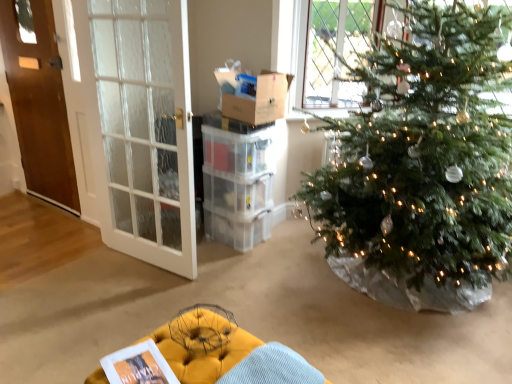
Question: From a real-world perspective, is yellow tufted ottoman at lower center over cardboard box at upper center?

Choices:
 (A) no
 (B) yes

Answer: (A)

Question: Would you consider yellow tufted ottoman at lower center to be distant from cardboard box at upper center?

Choices:
 (A) yes
 (B) no

Answer: (A)

Question: From a real-world perspective, is yellow tufted ottoman at lower center beneath cardboard box at upper center?

Choices:
 (A) no
 (B) yes

Answer: (B)

Question: Is yellow tufted ottoman at lower center facing away from cardboard box at upper center?

Choices:
 (A) yes
 (B) no

Answer: (B)

Question: Is the depth of yellow tufted ottoman at lower center less than that of cardboard box at upper center?

Choices:
 (A) yes
 (B) no

Answer: (A)

Question: Does point (267, 82) appear closer or farther from the camera than point (249, 336)?

Choices:
 (A) closer
 (B) farther

Answer: (B)

Question: From the image's perspective, is cardboard box at upper center located above or below yellow tufted ottoman at lower center?

Choices:
 (A) above
 (B) below

Answer: (A)

Question: From a real-world perspective, is cardboard box at upper center positioned above or below yellow tufted ottoman at lower center?

Choices:
 (A) above
 (B) below

Answer: (A)

Question: Considering their positions, is cardboard box at upper center located in front of or behind yellow tufted ottoman at lower center?

Choices:
 (A) front
 (B) behind

Answer: (B)

Question: Choose the correct answer: Is white glass door at left, which is the 2th door in back-to-front order, inside yellow tufted ottoman at lower center or outside it?

Choices:
 (A) inside
 (B) outside

Answer: (B)

Question: From a real-world perspective, is white glass door at left, which is counted as the 2th door, starting from the left, above or below yellow tufted ottoman at lower center?

Choices:
 (A) above
 (B) below

Answer: (A)

Question: Considering the positions of point (118, 198) and point (176, 319), is point (118, 198) closer or farther from the camera than point (176, 319)?

Choices:
 (A) closer
 (B) farther

Answer: (B)

Question: Is white glass door at left, which is the 2th door in back-to-front order, to the left or to the right of yellow tufted ottoman at lower center in the image?

Choices:
 (A) left
 (B) right

Answer: (A)

Question: Considering the positions of yellow tufted ottoman at lower center and cardboard box at upper center in the image, is yellow tufted ottoman at lower center taller or shorter than cardboard box at upper center?

Choices:
 (A) short
 (B) tall

Answer: (B)

Question: From a real-world perspective, is yellow tufted ottoman at lower center physically located above or below cardboard box at upper center?

Choices:
 (A) below
 (B) above

Answer: (A)